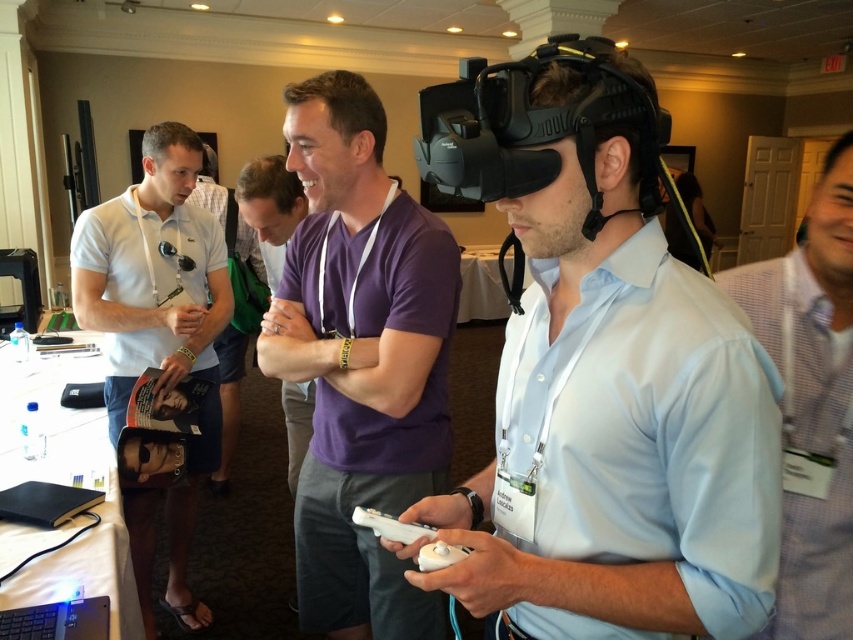
You are organizing a tech event and need to set up a VR station. The VR headset needs to be placed on a stand that can only hold items above a certain height. Given that the white checkered shirt at right is worn by a participant standing at the VR station, can the matte black vr headset at center be placed on the stand?

The matte black vr headset at center is located below the white checkered shirt at right, so it cannot be placed on the stand since it is positioned lower than the required height.

You are organizing a photo shoot and need to ensure that all props and subjects are visible in the frame. Given the scene described, will the white checkered shirt at right and the white matte game controller at center both fit within the camera frame if the frame can only accommodate objects up to the size of the larger of the two?

The white checkered shirt at right is larger than the white matte game controller at center. Since the camera frame can only accommodate objects up to the size of the larger object, the white checkered shirt at right may not fit within the frame, but the white matte game controller at center would fit as it is smaller.

You are organizing a tech event and need to place a promotional stand between the matte black vr headset at center and the white checkered shirt at right. Since the stand requires at least 1 meter of space, can you determine if there is enough room between them based on their heights?

The matte black vr headset at center is shorter than the white checkered shirt at right. However, the height difference does not provide information about the horizontal distance between them. Therefore, it is impossible to determine if there is enough space for the stand based solely on their heights.